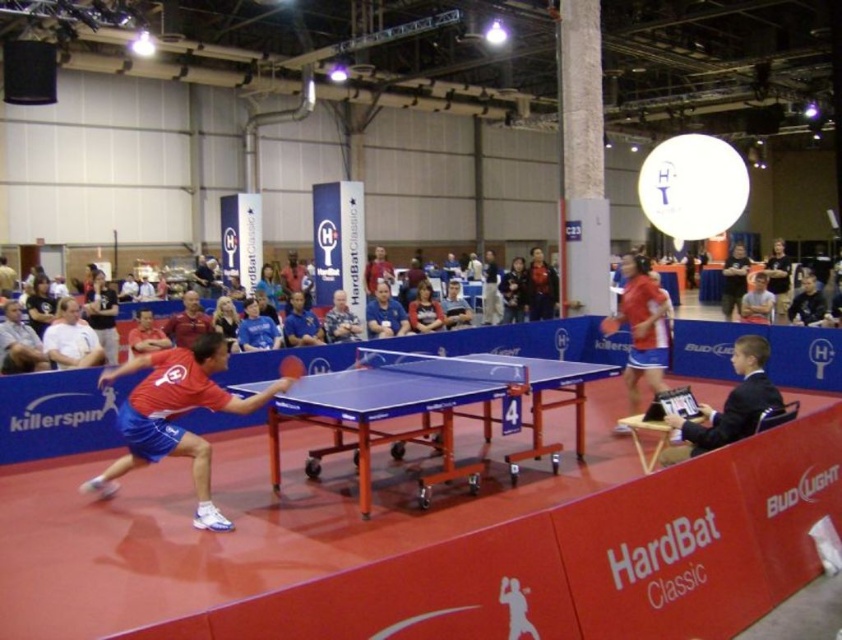
Question: Among these points, which one is farthest from the camera?

Choices:
 (A) 766,394
 (B) 549,458
 (C) 300,376

Answer: (C)

Question: Among these points, which one is nearest to the camera?

Choices:
 (A) (648, 330)
 (B) (475, 461)
 (C) (291, 356)
 (D) (761, 406)

Answer: (D)

Question: Is blue glossy table tennis table at center bigger than rubber paddle at center?

Choices:
 (A) yes
 (B) no

Answer: (B)

Question: Can you confirm if matte red shirt at center is thinner than blue glossy table tennis table at center?

Choices:
 (A) yes
 (B) no

Answer: (B)

Question: Estimate the real-world distances between objects in this image. Which object is closer to the rubber paddle at center?

Choices:
 (A) black suit at lower right
 (B) matte red shirt at center
 (C) matte red shirt at left
 (D) blue plastic table tennis table at center

Answer: (B)

Question: Is matte red shirt at left below black suit at lower right?

Choices:
 (A) no
 (B) yes

Answer: (B)